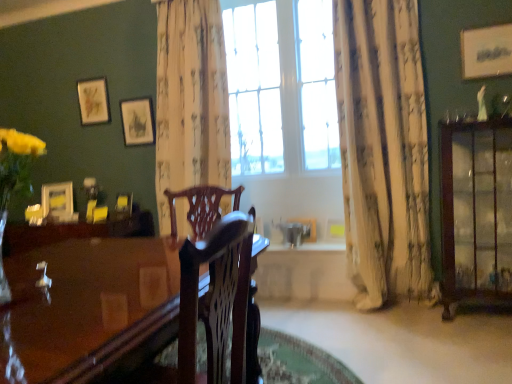
Describe the element at coordinates (306, 228) in the screenshot. I see `wooden picture frame at center, the first picture frame ordered from the bottom` at that location.

This screenshot has height=384, width=512. In order to click on glossy wood table at center in this screenshot , I will do `click(88, 308)`.

Measure the distance between point (120, 293) and camera.

Point (120, 293) is 3.99 feet away from camera.

Find the location of a particular element. This screenshot has height=384, width=512. clear glass window at center is located at coordinates (281, 85).

The width and height of the screenshot is (512, 384). Describe the element at coordinates (138, 121) in the screenshot. I see `matte white picture frame at upper center, placed as the 3th picture frame when sorted from left to right` at that location.

The width and height of the screenshot is (512, 384). What do you see at coordinates (93, 101) in the screenshot?
I see `matte gold picture frame at upper left, which appears as the fifth picture frame when ordered from the bottom` at bounding box center [93, 101].

The image size is (512, 384). In order to click on wooden picture frame at center, the third picture frame from the right in this screenshot , I will do `click(306, 228)`.

Between white floral fabric curtain at center, the second curtain in the right-to-left sequence, and mahogany wood chair at center, which one has more height?

Standing taller between the two is white floral fabric curtain at center, the second curtain in the right-to-left sequence.

Does white floral fabric curtain at center, the second curtain in the right-to-left sequence, have a greater width compared to mahogany wood chair at center?

In fact, white floral fabric curtain at center, the second curtain in the right-to-left sequence, might be narrower than mahogany wood chair at center.

How far apart are white floral fabric curtain at center, placed as the first curtain when sorted from left to right, and mahogany wood chair at center?

A distance of 35.52 inches exists between white floral fabric curtain at center, placed as the first curtain when sorted from left to right, and mahogany wood chair at center.

In the scene shown: From the image's perspective, is clear glass window at center beneath white floral fabric curtain at center, the second curtain in the right-to-left sequence?

No, from the image's perspective, clear glass window at center is not below white floral fabric curtain at center, the second curtain in the right-to-left sequence.

Considering the sizes of objects clear glass window at center and white floral fabric curtain at center, placed as the first curtain when sorted from left to right, in the image provided, who is shorter, clear glass window at center or white floral fabric curtain at center, placed as the first curtain when sorted from left to right,?

white floral fabric curtain at center, placed as the first curtain when sorted from left to right, is shorter.

Considering the positions of point (270, 83) and point (228, 186), is point (270, 83) closer or farther from the camera than point (228, 186)?

Point (270, 83).

Does clear glass window at center come behind white floral fabric curtain at center, placed as the first curtain when sorted from left to right?

Yes, it is behind white floral fabric curtain at center, placed as the first curtain when sorted from left to right.

From a real-world perspective, which object rests below the other?

From a 3D spatial view, yellow paper picture frame at center, marked as the 5th picture frame in a back-to-front arrangement, is below.

Is white textured curtain at right, which appears as the second curtain when viewed from the left, with yellow paper picture frame at center, which appears as the 2th picture frame when viewed from the front?

They are not placed beside each other.

Who is smaller, white textured curtain at right, which appears as the second curtain when viewed from the left, or yellow paper picture frame at center, the 2th picture frame when ordered from bottom to top?

With smaller size is yellow paper picture frame at center, the 2th picture frame when ordered from bottom to top.

Considering the positions of objects brown wood cabinet at right and matte yellow picture frame at left, which is the sixth picture frame from right to left, in the image provided, who is more to the left, brown wood cabinet at right or matte yellow picture frame at left, which is the sixth picture frame from right to left,?

matte yellow picture frame at left, which is the sixth picture frame from right to left.

From the image's perspective, which is below, brown wood cabinet at right or matte yellow picture frame at left, marked as the second picture frame in a back-to-front arrangement?

brown wood cabinet at right appears lower in the image.

Which object is closer to the camera taking this photo, brown wood cabinet at right or matte yellow picture frame at left, which is the 5th picture frame from front to back?

brown wood cabinet at right is closer to the camera.

From the picture: Does brown wood cabinet at right have a larger size compared to matte yellow picture frame at left, the 4th picture frame viewed from the top?

Indeed, brown wood cabinet at right has a larger size compared to matte yellow picture frame at left, the 4th picture frame viewed from the top.

Would you say white textured curtain at right, which appears as the 1th curtain when viewed from the right, is outside clear glass window at center?

Yes, white textured curtain at right, which appears as the 1th curtain when viewed from the right, is located beyond the bounds of clear glass window at center.

Considering the relative sizes of white textured curtain at right, which appears as the second curtain when viewed from the left, and clear glass window at center in the image provided, is white textured curtain at right, which appears as the second curtain when viewed from the left, wider than clear glass window at center?

Correct, the width of white textured curtain at right, which appears as the second curtain when viewed from the left, exceeds that of clear glass window at center.

Based on the photo, is white textured curtain at right, which appears as the second curtain when viewed from the left, not near clear glass window at center?

white textured curtain at right, which appears as the second curtain when viewed from the left, is actually quite close to clear glass window at center.

Which is more to the left, brown wood cabinet at right or white paper at upper right, which is counted as the 1th picture frame, starting from the right?

brown wood cabinet at right is more to the left.

Which of these two, brown wood cabinet at right or white paper at upper right, which is the first picture frame in top-to-bottom order, is bigger?

With larger size is brown wood cabinet at right.

Can you tell me how much brown wood cabinet at right and white paper at upper right, which is the first picture frame from front to back, differ in facing direction?

brown wood cabinet at right and white paper at upper right, which is the first picture frame from front to back, are facing 0.501 degrees away from each other.

Considering the positions of objects brown wood cabinet at right and white paper at upper right, marked as the 6th picture frame in a back-to-front arrangement, in the image provided, who is in front, brown wood cabinet at right or white paper at upper right, marked as the 6th picture frame in a back-to-front arrangement,?

brown wood cabinet at right.

Which is more to the right, mahogany wood chair at center or white textured curtain at right, which appears as the second curtain when viewed from the left?

Positioned to the right is white textured curtain at right, which appears as the second curtain when viewed from the left.

From the image's perspective, between mahogany wood chair at center and white textured curtain at right, which appears as the second curtain when viewed from the left, which one is located above?

From the image's view, white textured curtain at right, which appears as the second curtain when viewed from the left, is above.

From a real-world perspective, who is located higher, mahogany wood chair at center or white textured curtain at right, which appears as the 1th curtain when viewed from the right?

white textured curtain at right, which appears as the 1th curtain when viewed from the right, is physically above.

Is mahogany wood chair at center in front of or behind white textured curtain at right, which appears as the 1th curtain when viewed from the right, in the image?

In the image, mahogany wood chair at center appears in front of white textured curtain at right, which appears as the 1th curtain when viewed from the right.

From a real-world perspective, which curtain is the 2nd one above the mahogany wood chair at center? Please provide its 2D coordinates.

[(190, 100)]

The image size is (512, 384). Find the location of `window below the white floral fabric curtain at center, the second curtain in the right-to-left sequence (from a real-world perspective)`. window below the white floral fabric curtain at center, the second curtain in the right-to-left sequence (from a real-world perspective) is located at coordinates (281, 85).

Looking at the image, which one is located closer to mahogany wood chair at center, brown wood cabinet at right or white textured curtain at right, which appears as the 1th curtain when viewed from the right?

white textured curtain at right, which appears as the 1th curtain when viewed from the right, lies closer to mahogany wood chair at center than the other object.

Estimate the real-world distances between objects in this image. Which object is closer to wooden picture frame at center, the 4th picture frame in the back-to-front sequence, white floral fabric curtain at center, the second curtain in the right-to-left sequence, or matte gold picture frame at upper left, the fifth picture frame when ordered from right to left?

white floral fabric curtain at center, the second curtain in the right-to-left sequence, is positioned closer to the anchor wooden picture frame at center, the 4th picture frame in the back-to-front sequence.

Considering their positions, is yellow paper picture frame at center, the 2th picture frame when ordered from bottom to top, positioned further to wooden picture frame at center, which is the third picture frame in front-to-back order, than white paper at upper right, which is the first picture frame in top-to-bottom order?

white paper at upper right, which is the first picture frame in top-to-bottom order, is positioned further to the anchor wooden picture frame at center, which is the third picture frame in front-to-back order.

Which object lies further to the anchor point brown wood cabinet at right, matte gold picture frame at upper left, the fifth picture frame when ordered from right to left, or matte white picture frame at upper center, placed as the 3th picture frame when sorted from left to right?

matte gold picture frame at upper left, the fifth picture frame when ordered from right to left, is positioned further to the anchor brown wood cabinet at right.

When comparing their distances from clear glass window at center, does wooden picture frame at center, the third picture frame from the right, or white textured curtain at right, which appears as the 1th curtain when viewed from the right, seem further?

The object further to clear glass window at center is wooden picture frame at center, the third picture frame from the right.

When comparing their distances from yellow paper picture frame at center, which appears as the 2th picture frame when viewed from the front, does matte gold picture frame at upper left, which ranks as the 2th picture frame in top-to-bottom order, or white floral fabric curtain at center, placed as the first curtain when sorted from left to right, seem further?

matte gold picture frame at upper left, which ranks as the 2th picture frame in top-to-bottom order, is further to yellow paper picture frame at center, which appears as the 2th picture frame when viewed from the front.

Estimate the real-world distances between objects in this image. Which object is closer to wooden picture frame at center, the third picture frame from the right, matte yellow picture frame at left, which is the sixth picture frame from right to left, or white textured curtain at right, which appears as the 1th curtain when viewed from the right?

white textured curtain at right, which appears as the 1th curtain when viewed from the right, is positioned closer to the anchor wooden picture frame at center, the third picture frame from the right.

Which object lies further to the anchor point matte gold picture frame at upper left, which appears as the fifth picture frame when ordered from the bottom, glossy wood table at center or white paper at upper right, which is the first picture frame from front to back?

Among the two, white paper at upper right, which is the first picture frame from front to back, is located further to matte gold picture frame at upper left, which appears as the fifth picture frame when ordered from the bottom.

This screenshot has height=384, width=512. I want to click on curtain between matte yellow picture frame at left, the 4th picture frame viewed from the top, and yellow paper picture frame at center, which appears as the 2th picture frame when viewed from the front, from left to right, so click(x=190, y=100).

The image size is (512, 384). What are the coordinates of `chair between glossy wood table at center and white paper at upper right, the sixth picture frame positioned from the bottom, from left to right` in the screenshot? It's located at (201, 206).

Identify the location of cabinetry between glossy wood table at center and clear glass window at center along the z-axis. This screenshot has width=512, height=384. (476, 211).

The image size is (512, 384). I want to click on window situated between white floral fabric curtain at center, the second curtain in the right-to-left sequence, and brown wood cabinet at right from left to right, so click(281, 85).